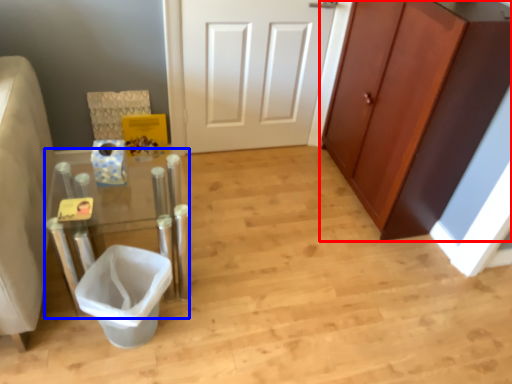
Question: Among these objects, which one is nearest to the camera, cabinetry (highlighted by a red box) or vanity (highlighted by a blue box)?

Choices:
 (A) cabinetry
 (B) vanity

Answer: (B)